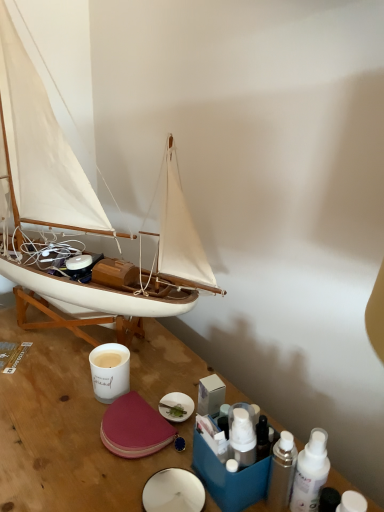
Question: Is white matte bottle at lower right, which appears as the 3th toiletry when viewed from the left, wider or thinner than white matte cup at center?

Choices:
 (A) thin
 (B) wide

Answer: (A)

Question: From a real-world perspective, is white matte bottle at lower right, which appears as the 3th toiletry when viewed from the left, physically located above or below white matte cup at center?

Choices:
 (A) below
 (B) above

Answer: (B)

Question: Which of these objects is positioned closest to the wooden table at center?

Choices:
 (A) white matte bottle at lower right, marked as the first toiletry in a right-to-left arrangement
 (B) white matte cup at center
 (C) metallic silver spray can at lower right, which is the first toiletry from left to right
 (D) white matte sailboat at left
 (E) metallic silver spray can at lower right, the 2th toiletry in the left-to-right sequence

Answer: (B)

Question: Which object is the closest to the white matte cup at center?

Choices:
 (A) white matte sailboat at left
 (B) metallic silver spray can at lower right, the second toiletry in the right-to-left sequence
 (C) metallic silver spray can at lower right, which is the first toiletry from left to right
 (D) white matte bottle at lower right, which appears as the 3th toiletry when viewed from the left
 (E) wooden table at center

Answer: (E)